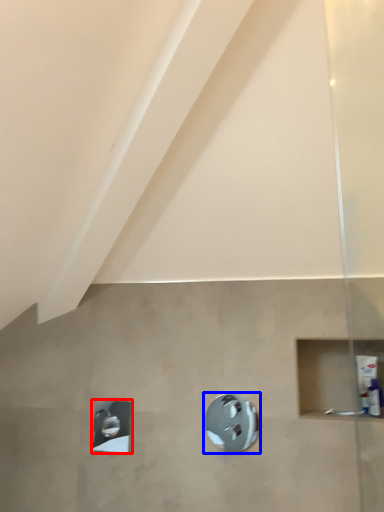
Question: Which point is further to the camera, shower (highlighted by a red box) or shower (highlighted by a blue box)?

Choices:
 (A) shower
 (B) shower

Answer: (A)